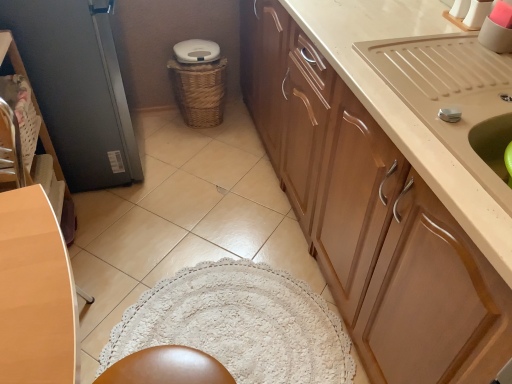
Identify the location of free space above beige glossy sink at upper right (from a real-world perspective). This screenshot has height=384, width=512. (463, 82).